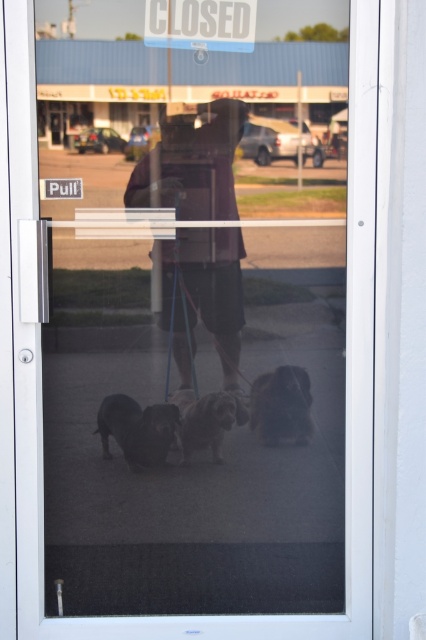
Question: Can you confirm if white plastic sign at upper center is bigger than dark brown fur at center?

Choices:
 (A) yes
 (B) no

Answer: (A)

Question: Which object appears closest to the camera in this image?

Choices:
 (A) short-haired brown dog at center
 (B) dark brown fur at center
 (C) white plastic sign at upper center
 (D) dark brown leather jacket at center

Answer: (C)

Question: Where is dark brown fur at center located in relation to short-haired brown dog at center in the image?

Choices:
 (A) below
 (B) above

Answer: (A)

Question: Which point is farther from the camera taking this photo?

Choices:
 (A) (221, 12)
 (B) (95, 429)

Answer: (B)

Question: Based on their relative distances, which object is farther from the fluffy brown dog at center?

Choices:
 (A) dark brown leather jacket at center
 (B) dark brown fur at center

Answer: (A)

Question: Is white plastic sign at upper center further to the viewer compared to fluffy brown dog at center?

Choices:
 (A) no
 (B) yes

Answer: (A)